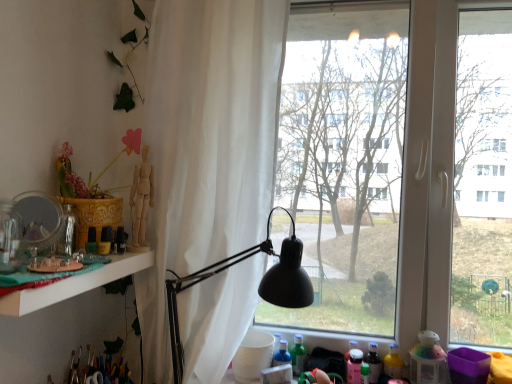
This screenshot has height=384, width=512. In order to click on free space to the back side of matte silver mirror at left in this screenshot , I will do `click(78, 252)`.